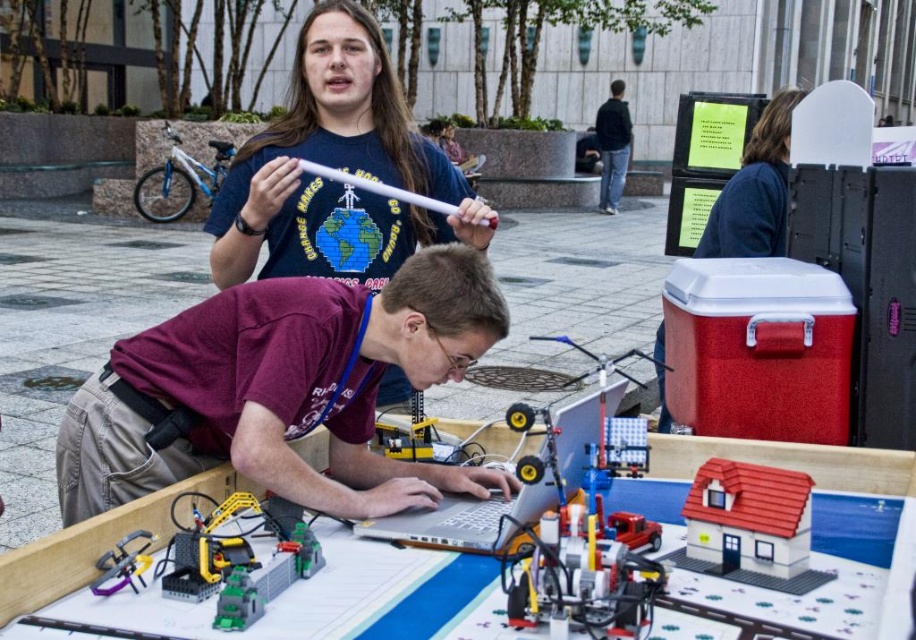
Question: Which of the following is the farthest from the observer?

Choices:
 (A) (618, 90)
 (B) (170, 387)
 (C) (232, 250)
 (D) (139, 580)

Answer: (A)

Question: Is silver metallic laptop at center below matte red cooler at upper right?

Choices:
 (A) no
 (B) yes

Answer: (B)

Question: Which of these objects is positioned closest to the brick red plastic house at center?

Choices:
 (A) maroon shirt at center
 (B) matte blue t-shirt at upper center

Answer: (A)

Question: Does white plastic table at center appear under plastic toy house at center?

Choices:
 (A) no
 (B) yes

Answer: (A)

Question: Does plastic toy house at center appear on the right side of silver metallic laptop at center?

Choices:
 (A) no
 (B) yes

Answer: (B)

Question: Which object is closer to the camera taking this photo?

Choices:
 (A) brick red plastic house at center
 (B) maroon shirt at center
 (C) plastic toy house at center
 (D) white plastic table at center

Answer: (C)